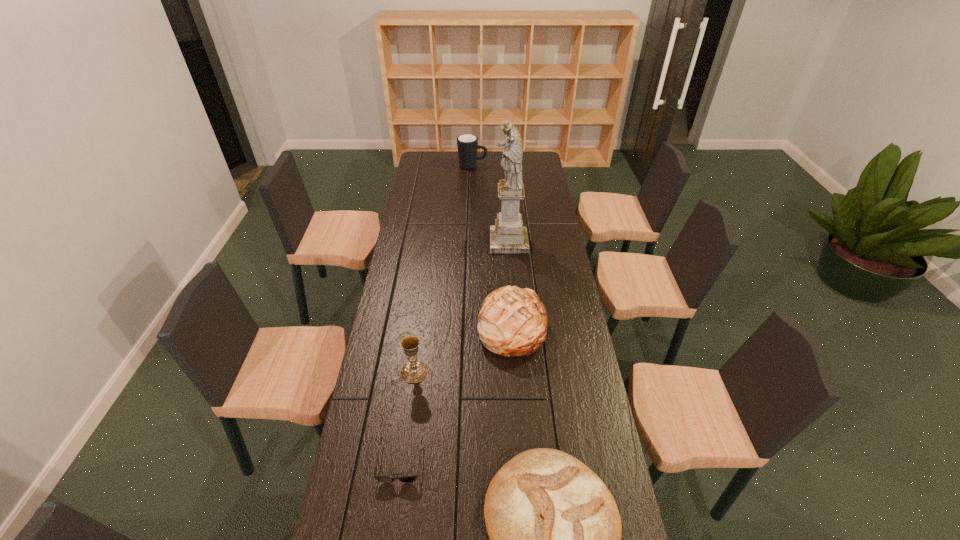
This screenshot has height=540, width=960. Find the location of `the tallest object`. the tallest object is located at coordinates (508, 236).

At what (x,y) coordinates should I click in order to perform the action: click on the fifth nearest object. Please return your answer as a coordinate pair (x, y). The width and height of the screenshot is (960, 540). Looking at the image, I should click on (508, 236).

The width and height of the screenshot is (960, 540). Identify the location of the farthest object. (467, 144).

I want to click on the taller bread, so click(x=512, y=322).

The width and height of the screenshot is (960, 540). What are the coordinates of `the third farthest object` in the screenshot? It's located at (512, 322).

Find the location of `the third nearest object`. the third nearest object is located at coordinates (413, 371).

At what (x,y) coordinates should I click in order to perform the action: click on the shortest object. Please return your answer as a coordinate pair (x, y). The height and width of the screenshot is (540, 960). Looking at the image, I should click on (384, 479).

Find the location of a particular element. vacant area located on the front-facing side of the tallest object is located at coordinates (405, 241).

The image size is (960, 540). I want to click on free space located 0.150m on the front-facing side of the tallest object, so click(x=457, y=241).

The width and height of the screenshot is (960, 540). I want to click on vacant area located 0.130m on the front-facing side of the tallest object, so click(x=462, y=241).